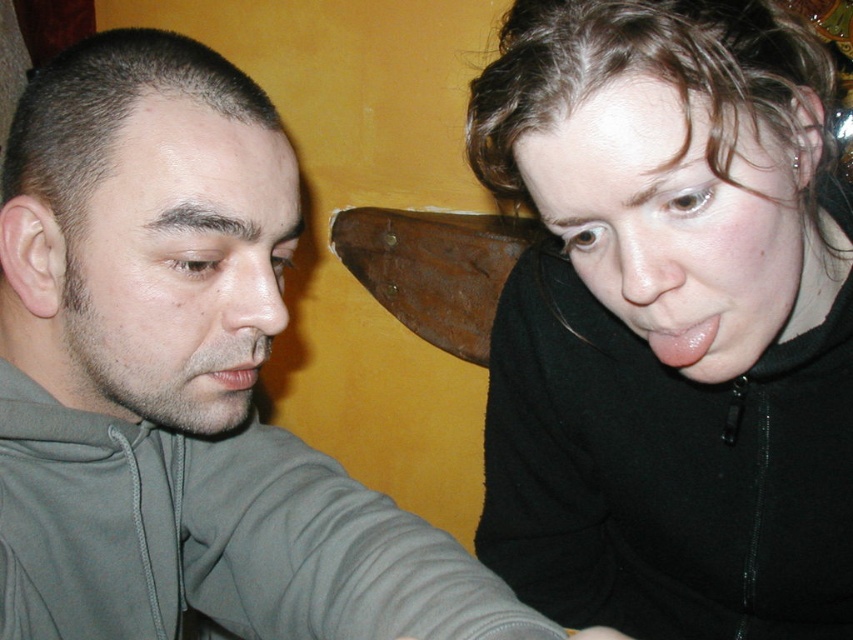
You are a photographer trying to frame a shot of the black fleece jacket at upper right and the matte gray mouth at lower left. Which object should you zoom in on to ensure both fit in the frame without cropping?

The black fleece jacket at upper right is wider than the matte gray mouth at lower left, so you should zoom in on the matte gray mouth at lower left to ensure both fit in the frame without cropping.

You are standing in front of the image and want to locate the gray matte hoodie at left. Which coordinate point would you look at to find it?

The gray matte hoodie at left is located at coordinate point [178,380].